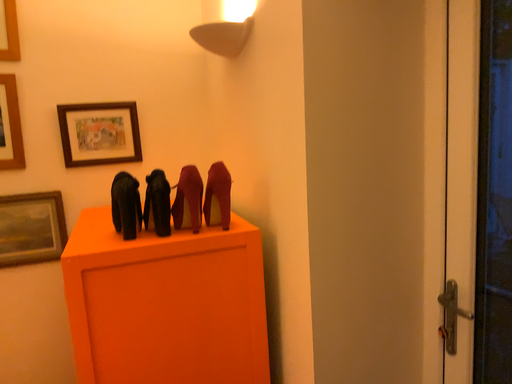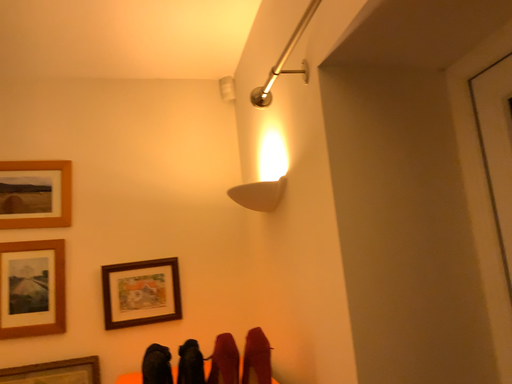
Question: Which way did the camera rotate in the video?

Choices:
 (A) rotated right
 (B) rotated left

Answer: (B)